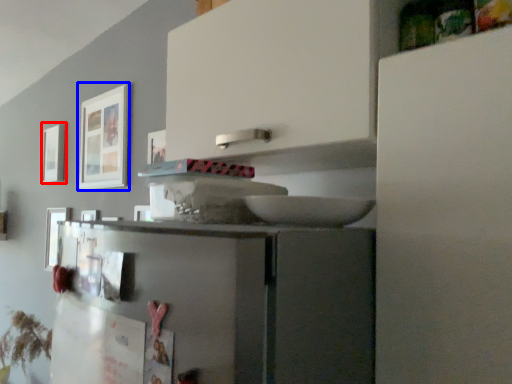
Question: Which object appears closest to the camera in this image, picture frame (highlighted by a red box) or picture frame (highlighted by a blue box)?

Choices:
 (A) picture frame
 (B) picture frame

Answer: (B)